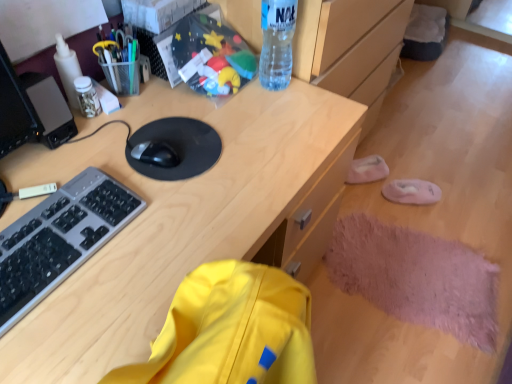
The width and height of the screenshot is (512, 384). What are the coordinates of `vacant region above wooden desk at center (from a real-world perspective)` in the screenshot? It's located at (99, 204).